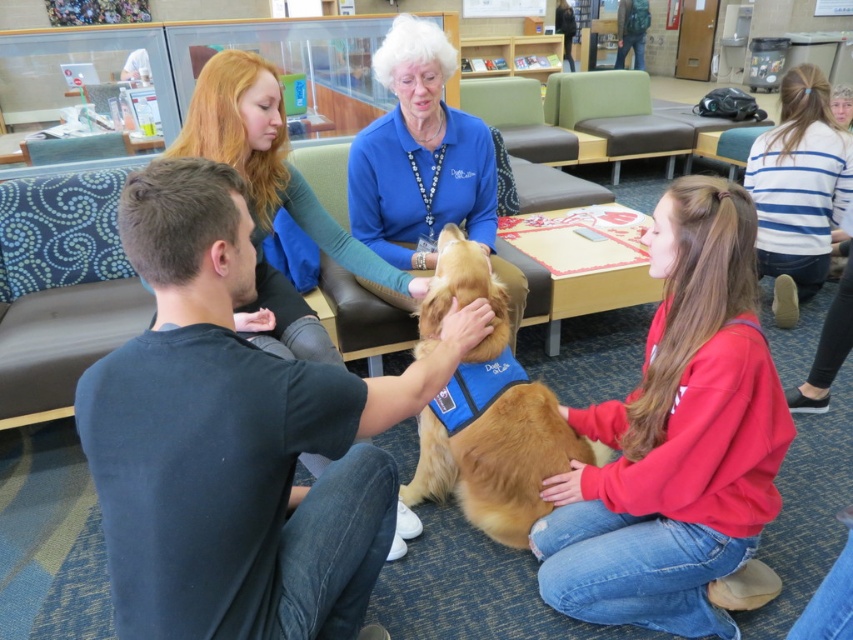
You are a photographer standing in front of the scene. You want to take a photo of the golden fur dog at center and the blue fabric at center. Which object should you focus on first to ensure both are in sharp focus?

The golden fur dog at center is further to the viewer than the blue fabric at center, so you should focus on the golden fur dog at center first to ensure both are in sharp focus.

You are standing in the library and want to place a small plant pot exactly where the blue fabric at center is located. What are the coordinates for placing the plant pot?

The coordinates for placing the plant pot at the location of the blue fabric at center are 0.306 in the x direction and 0.321 in the y direction.

You are a delivery person who needs to place a small package between the blue fabric at center and the blue striped sweater at upper right. The package requires a minimum of 2 meters of space to ensure it doesn not obstruct the path. Based on the scene, can you safely place the package there?

The blue fabric at center and the blue striped sweater at upper right are 1.89 meters apart. Since the required space is 2 meters, the package cannot be placed there without obstructing the path.